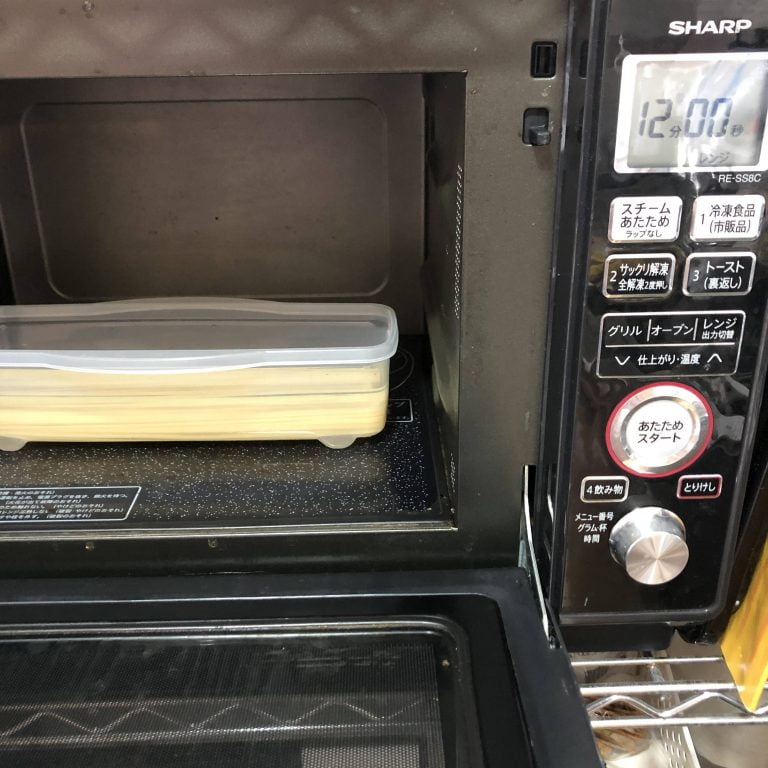
The width and height of the screenshot is (768, 768). I want to click on brand of microwave, so click(674, 28), click(694, 28), click(709, 28), click(730, 30), click(742, 27).